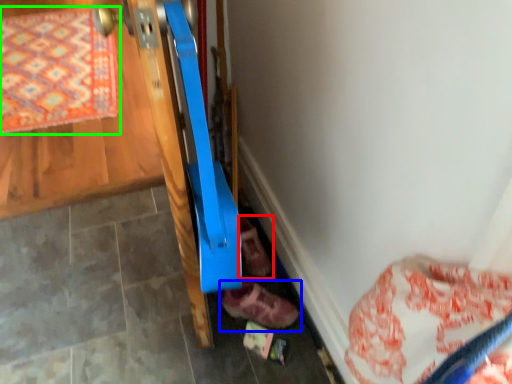
Question: Which is nearer to the footwear (highlighted by a red box)? footwear (highlighted by a blue box) or mat (highlighted by a green box).

Choices:
 (A) footwear
 (B) mat

Answer: (A)